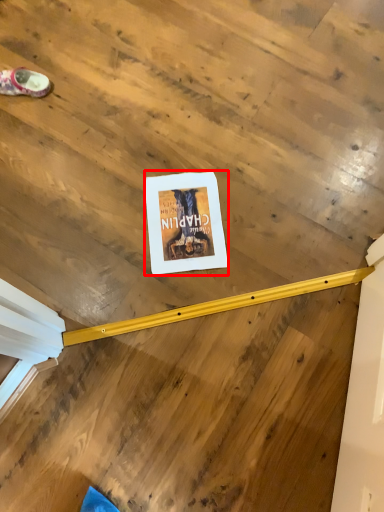
Question: Observing the image, what is the correct spatial positioning of poster page (annotated by the red box) in reference to footwear?

Choices:
 (A) left
 (B) right

Answer: (B)